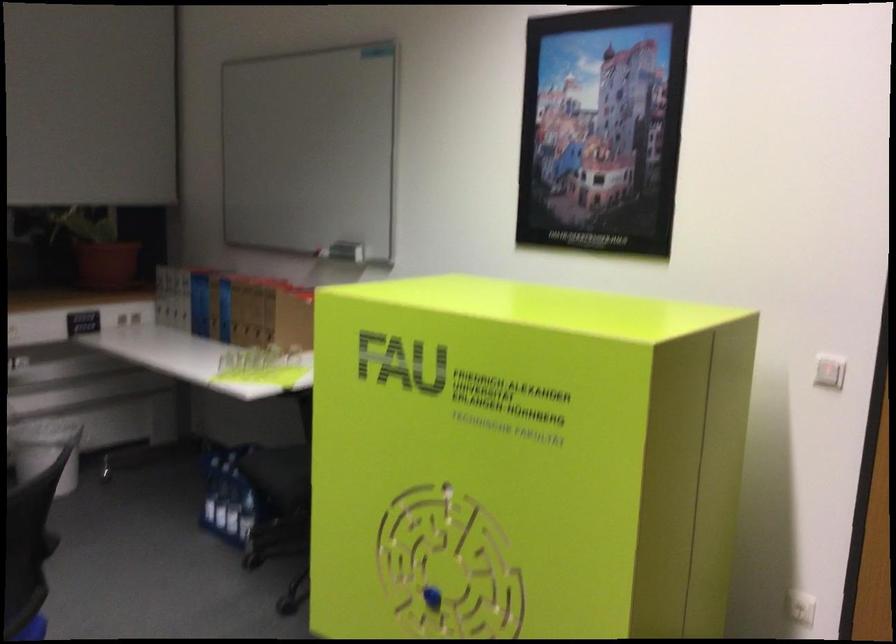
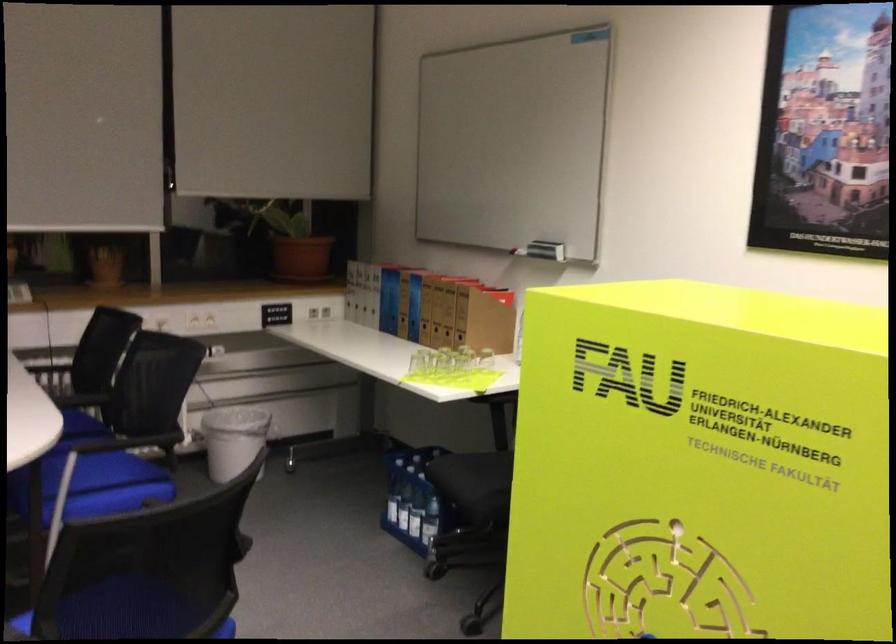
Find the pixel in the second image that matches point 212,498 in the first image.

(392, 500)